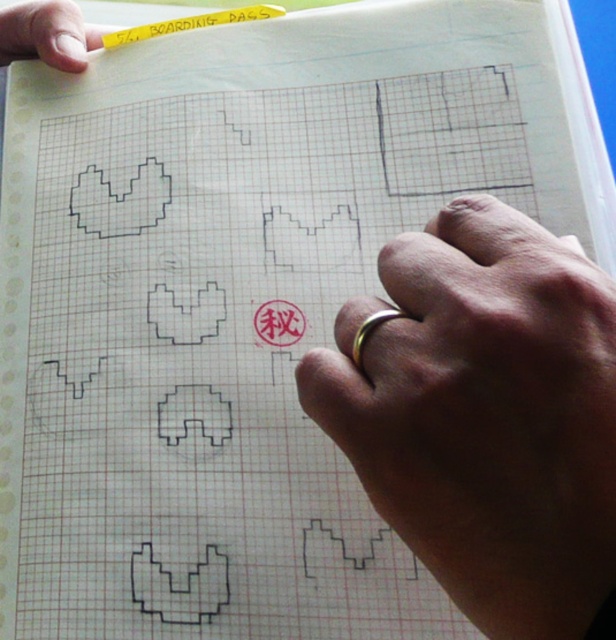
Question: Which object appears farthest from the camera in this image?

Choices:
 (A) matte white paper at upper left
 (B) gold ring at center
 (C) yellow paper at upper left

Answer: (A)

Question: Can you confirm if matte white paper at upper left is positioned to the left of yellow paper at upper left?

Choices:
 (A) no
 (B) yes

Answer: (B)

Question: Can you confirm if gold ring at center is positioned to the right of yellow paper at upper left?

Choices:
 (A) yes
 (B) no

Answer: (A)

Question: Which object is the farthest from the gold ring at center?

Choices:
 (A) matte white paper at upper left
 (B) yellow paper at upper left

Answer: (A)

Question: Which point is closer to the camera taking this photo?

Choices:
 (A) (601, 573)
 (B) (4, 60)

Answer: (A)

Question: Does matte white paper at upper left have a smaller size compared to yellow paper at upper left?

Choices:
 (A) no
 (B) yes

Answer: (A)